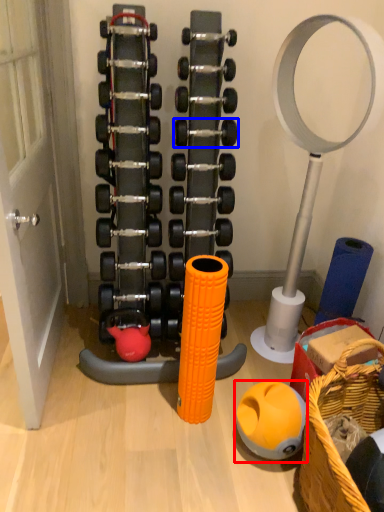
Question: Among these objects, which one is farthest to the camera, ball (highlighted by a red box) or dumbbell (highlighted by a blue box)?

Choices:
 (A) ball
 (B) dumbbell

Answer: (B)